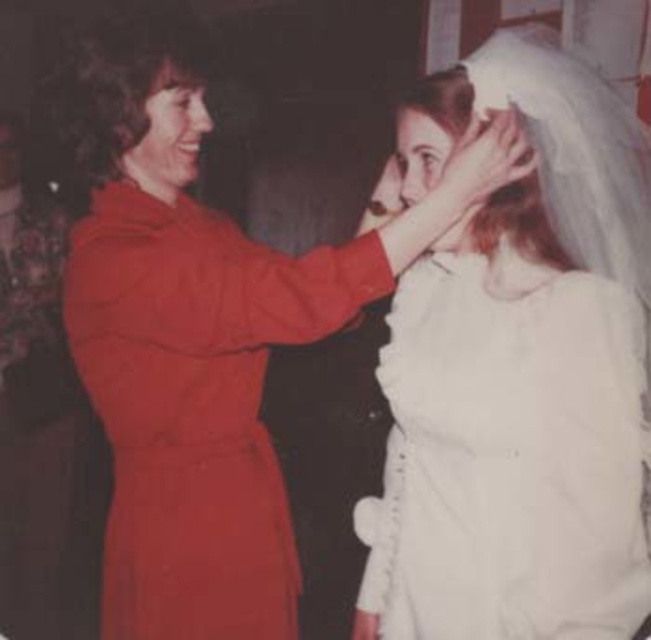
You are a photographer adjusting the focus of your camera. You have two points to focus on in the image. The first point is at coordinates point (x=585, y=156) and the second point is at point (x=243, y=531). Which point should you focus on if you want to capture the subject closest to the camera?

You should focus on point (x=585, y=156) because it is closer to the camera than point (x=243, y=531).

You are a photographer at a wedding. You need to adjust the lighting to highlight the white satin veil at upper center. Where exactly should you position the light source relative to the veil?

The white satin veil at upper center is located at point (518, 371). To highlight it effectively, position the light source directly above and slightly in front of the veil at that coordinate to ensure it catches the light without casting shadows.